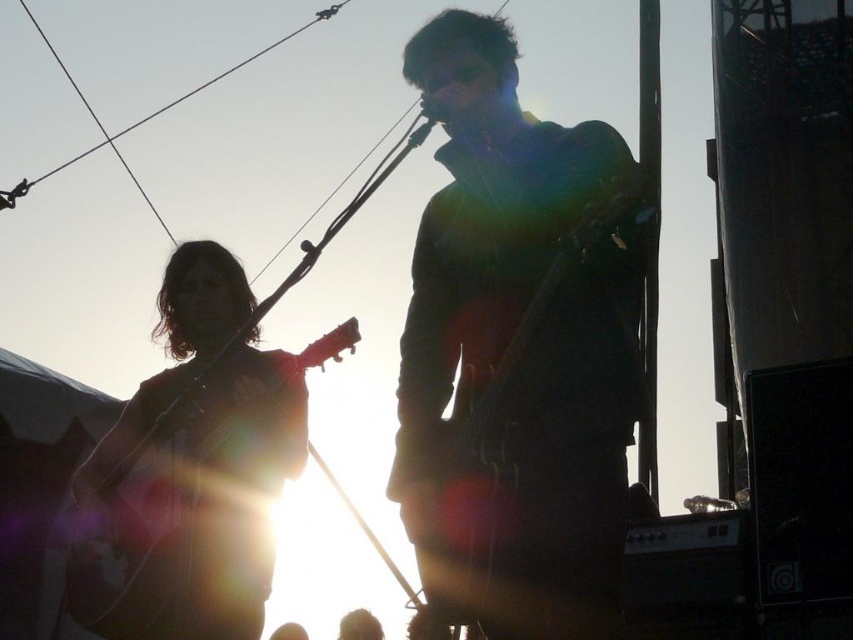
Who is shorter, wooden acoustic guitar at left or matte black guitar at center?

With less height is matte black guitar at center.

From the picture: Is wooden acoustic guitar at left below matte black guitar at center?

Yes.

Does point (120, 509) come behind point (408, 442)?

Yes, point (120, 509) is farther from viewer.

At what (x,y) coordinates should I click in order to perform the action: click on wooden acoustic guitar at left. Please return your answer as a coordinate pair (x, y). Image resolution: width=853 pixels, height=640 pixels. Looking at the image, I should click on (202, 508).